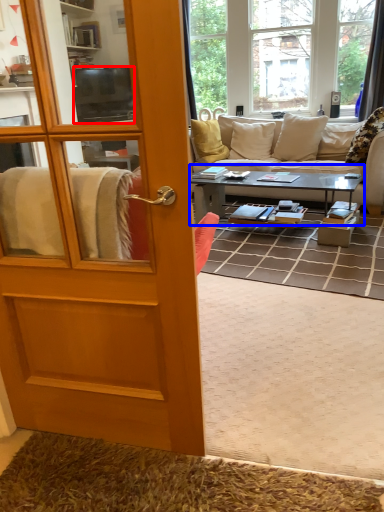
Question: Which point is closer to the camera, television (highlighted by a red box) or coffee table (highlighted by a blue box)?

Choices:
 (A) television
 (B) coffee table

Answer: (B)